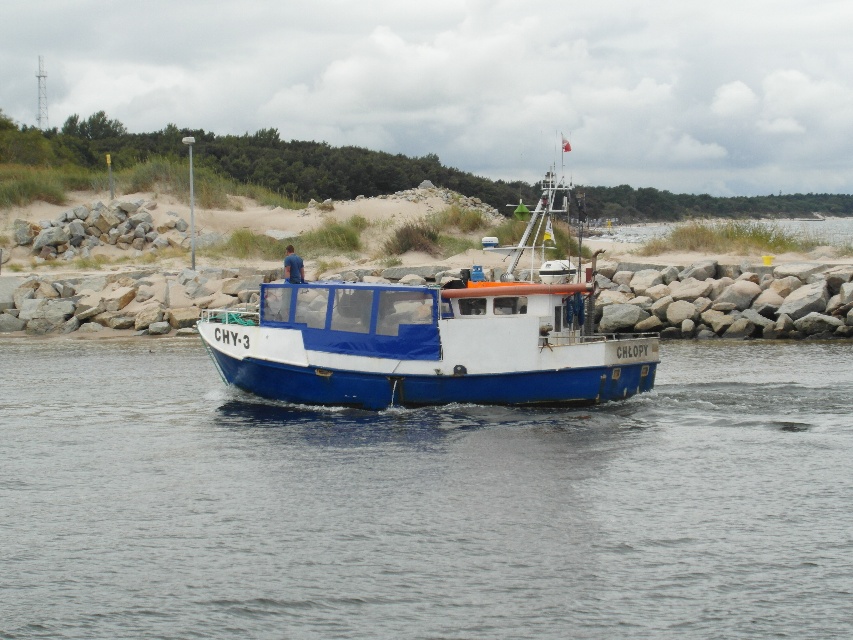
Does blue matte water at center lie behind blue matte boat at center?

That is False.

Is point (488, 534) positioned behind point (379, 394)?

No, it is in front of (379, 394).

Find the location of a particular element. The width and height of the screenshot is (853, 640). blue matte water at center is located at coordinates (422, 502).